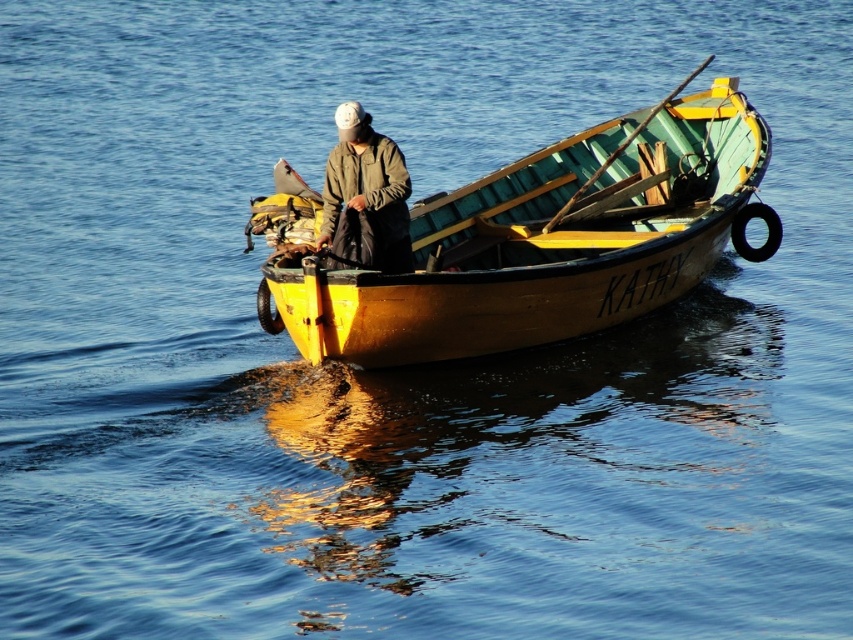
Consider the image. You are standing on the deck of the boat named KATHY and looking at two points marked on the boat. The first point is at coordinates point [398,301] and the second point is at point [387,168]. Which of these points is closer to your viewpoint?

Point [398,301] is closer to the camera than point [387,168], so the first point is closer to your viewpoint.

You are standing on the dock and looking at the wooden boat at center and the green matte jacket at center. Which object is nearer to you?

The wooden boat at center is closer to the viewer than the green matte jacket at center, so the wooden boat at center is nearer to you.